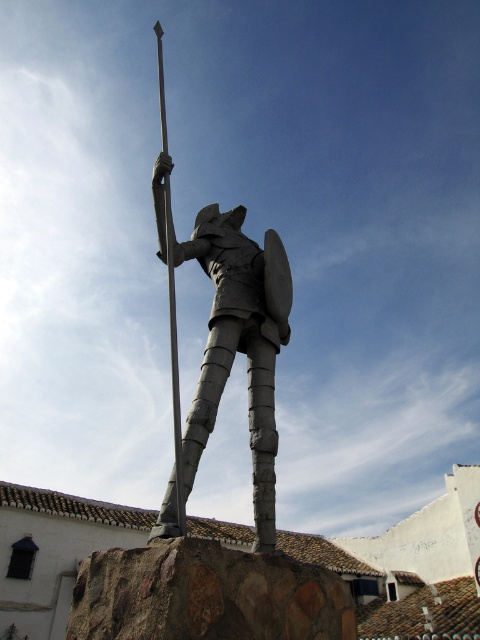
Which of these two, gray stone warrior at center or polished metal pole at center, stands taller?

polished metal pole at center

Which is in front, point (268, 320) or point (167, 195)?

Point (167, 195)

Locate an element on the screen. gray stone warrior at center is located at coordinates (240, 344).